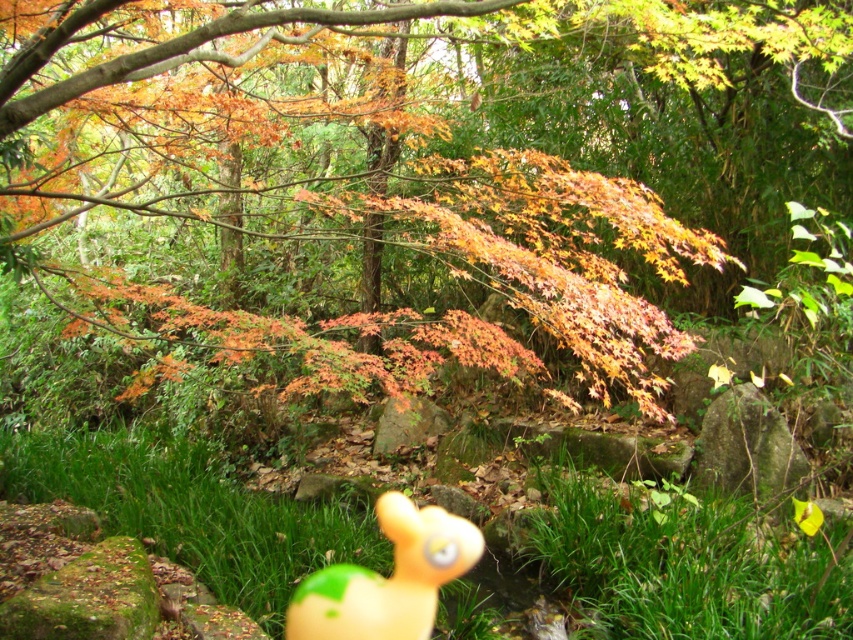
You are standing in the forest scene described. You see the green leafy grass at lower center. Where exactly is it located in terms of coordinates?

The green leafy grass at lower center is located at coordinates point (x=682, y=563).

You are a child playing in the forest and you see the green grass at lower center and the rubber duck at center. Which object takes up more space in the image?

The rubber duck at center takes up more space than the green grass at lower center.